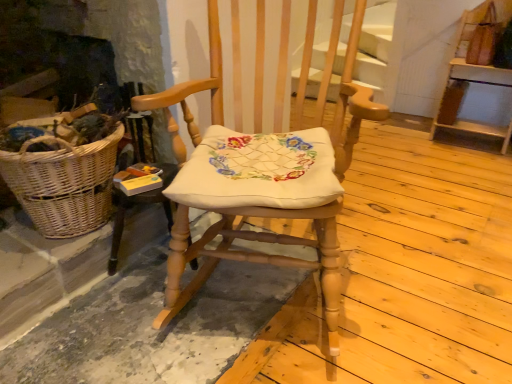
This screenshot has width=512, height=384. In order to click on free spot to the left of wooden shelf at upper right in this screenshot , I will do `click(406, 141)`.